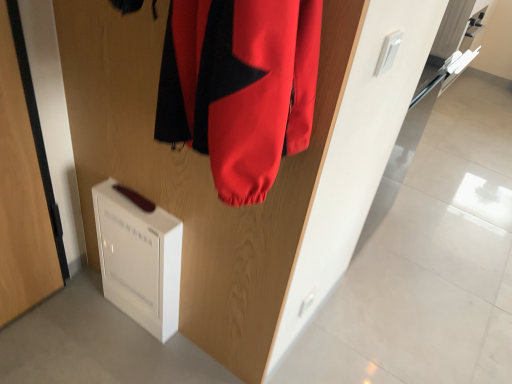
Question: Considering the relative positions of wooden door at center, the 2th door in the left-to-right sequence, and white plastic air purifier at lower left in the image provided, is wooden door at center, the 2th door in the left-to-right sequence, to the left of white plastic air purifier at lower left from the viewer's perspective?

Choices:
 (A) no
 (B) yes

Answer: (A)

Question: Can you confirm if wooden door at center, the 2th door in the left-to-right sequence, is smaller than white plastic air purifier at lower left?

Choices:
 (A) no
 (B) yes

Answer: (A)

Question: From the image's perspective, is wooden door at center, placed as the 1th door when sorted from right to left, on white plastic air purifier at lower left?

Choices:
 (A) no
 (B) yes

Answer: (B)

Question: Could white plastic air purifier at lower left be considered to be inside wooden door at center, placed as the 1th door when sorted from right to left?

Choices:
 (A) no
 (B) yes

Answer: (A)

Question: From a real-world perspective, does wooden door at center, placed as the 1th door when sorted from right to left, stand above white plastic air purifier at lower left?

Choices:
 (A) yes
 (B) no

Answer: (A)

Question: Is point (201, 190) closer or farther from the camera than point (145, 276)?

Choices:
 (A) farther
 (B) closer

Answer: (B)

Question: From a real-world perspective, is wooden door at center, placed as the 1th door when sorted from right to left, positioned above or below white plastic air purifier at lower left?

Choices:
 (A) below
 (B) above

Answer: (B)

Question: In terms of size, does wooden door at center, the 2th door in the left-to-right sequence, appear bigger or smaller than white plastic air purifier at lower left?

Choices:
 (A) small
 (B) big

Answer: (B)

Question: Is wooden door at center, the 2th door in the left-to-right sequence, in front of or behind white plastic air purifier at lower left in the image?

Choices:
 (A) front
 (B) behind

Answer: (A)

Question: In terms of width, does white plastic air purifier at lower left look wider or thinner when compared to white matte door at lower left, which is counted as the first door, starting from the left?

Choices:
 (A) thin
 (B) wide

Answer: (A)

Question: Is white plastic air purifier at lower left bigger or smaller than white matte door at lower left, the 2th door positioned from the right?

Choices:
 (A) big
 (B) small

Answer: (B)

Question: Is point (114, 246) positioned closer to the camera than point (10, 152)?

Choices:
 (A) farther
 (B) closer

Answer: (A)

Question: Is white plastic air purifier at lower left situated inside white matte door at lower left, which is counted as the first door, starting from the left, or outside?

Choices:
 (A) inside
 (B) outside

Answer: (B)

Question: Is white matte door at lower left, which is counted as the first door, starting from the left, bigger or smaller than white plastic air purifier at lower left?

Choices:
 (A) small
 (B) big

Answer: (B)

Question: Considering the positions of white matte door at lower left, the 2th door positioned from the right, and white plastic air purifier at lower left in the image, is white matte door at lower left, the 2th door positioned from the right, wider or thinner than white plastic air purifier at lower left?

Choices:
 (A) thin
 (B) wide

Answer: (B)